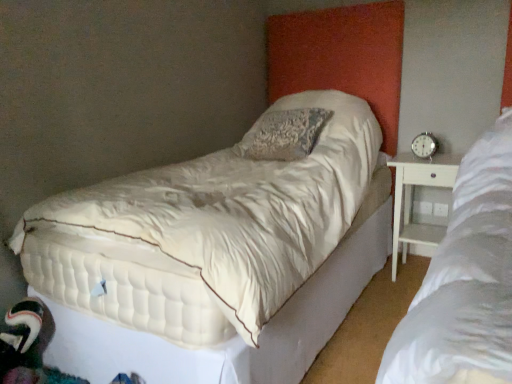
Question: From the image's perspective, is silver metallic alarm clock at right located above white wood nightstand at right?

Choices:
 (A) yes
 (B) no

Answer: (A)

Question: From a real-world perspective, is silver metallic alarm clock at right below white wood nightstand at right?

Choices:
 (A) no
 (B) yes

Answer: (A)

Question: Can you confirm if silver metallic alarm clock at right is thinner than white wood nightstand at right?

Choices:
 (A) yes
 (B) no

Answer: (A)

Question: From a real-world perspective, is silver metallic alarm clock at right physically above white wood nightstand at right?

Choices:
 (A) no
 (B) yes

Answer: (B)

Question: Is silver metallic alarm clock at right next to white wood nightstand at right and touching it?

Choices:
 (A) no
 (B) yes

Answer: (A)

Question: Does silver metallic alarm clock at right have a larger size compared to white wood nightstand at right?

Choices:
 (A) no
 (B) yes

Answer: (A)

Question: Is silver metallic alarm clock at right at the right side of white quilted mattress at center?

Choices:
 (A) yes
 (B) no

Answer: (A)

Question: Can you confirm if silver metallic alarm clock at right is wider than white quilted mattress at center?

Choices:
 (A) no
 (B) yes

Answer: (A)

Question: Does silver metallic alarm clock at right have a lesser width compared to white quilted mattress at center?

Choices:
 (A) no
 (B) yes

Answer: (B)

Question: Could you tell me if silver metallic alarm clock at right is facing white quilted mattress at center?

Choices:
 (A) no
 (B) yes

Answer: (B)

Question: From the image's perspective, would you say silver metallic alarm clock at right is shown under white quilted mattress at center?

Choices:
 (A) no
 (B) yes

Answer: (A)

Question: Is there a large distance between silver metallic alarm clock at right and white quilted mattress at center?

Choices:
 (A) no
 (B) yes

Answer: (B)

Question: Considering the relative positions of white quilted mattress at center and white wood nightstand at right in the image provided, is white quilted mattress at center to the right of white wood nightstand at right from the viewer's perspective?

Choices:
 (A) yes
 (B) no

Answer: (B)